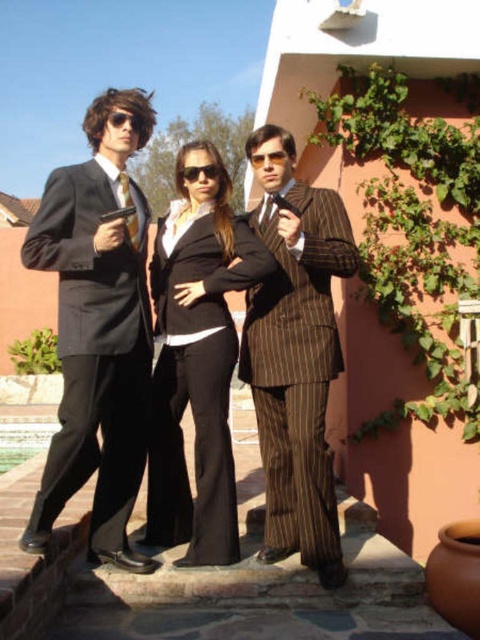
Question: Is matte black suit at center positioned behind gold pinstripe suit at center?

Choices:
 (A) yes
 (B) no

Answer: (B)

Question: Is matte black suit at center above pinstriped fabric tie at center?

Choices:
 (A) no
 (B) yes

Answer: (A)

Question: Which of these objects is positioned closest to the matte black suit at left?

Choices:
 (A) gold pinstripe suit at center
 (B) matte black suit at center
 (C) black pinstripe tie at center

Answer: (B)

Question: Is the position of matte black suit at center less distant than that of matte black suit at left?

Choices:
 (A) no
 (B) yes

Answer: (B)

Question: Which point is farther to the camera?

Choices:
 (A) (111, 440)
 (B) (63, 392)
 (C) (194, 436)
 (D) (195, 177)

Answer: (D)

Question: Which point appears closest to the camera in this image?

Choices:
 (A) (54, 198)
 (B) (175, 262)

Answer: (A)